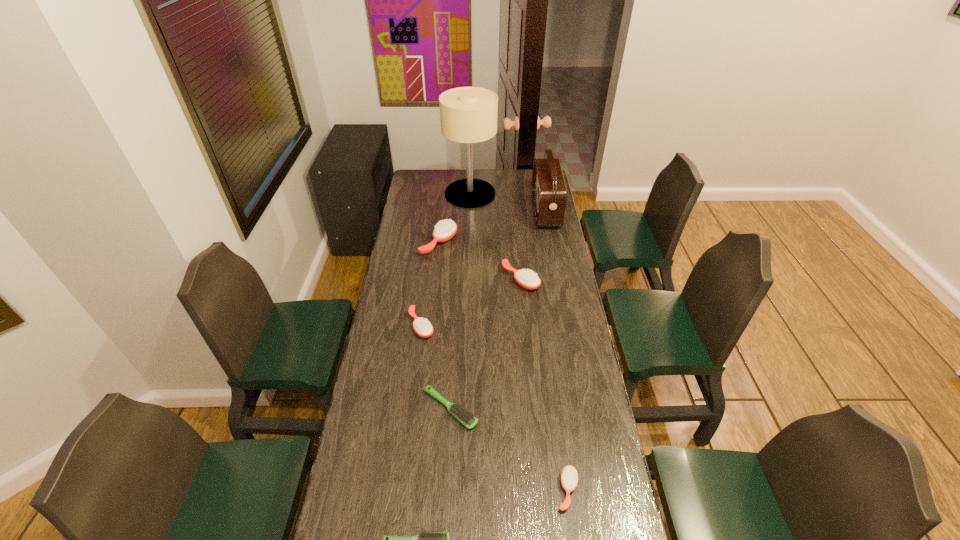
Where is `vacant space situated 0.310m on the right of the sixth farthest object`? The height and width of the screenshot is (540, 960). vacant space situated 0.310m on the right of the sixth farthest object is located at coordinates (568, 409).

Identify the location of free space located on the back of the smallest orange hairbrush. The height and width of the screenshot is (540, 960). (561, 444).

Locate an element on the screen. The image size is (960, 540). object located in the far edge section of the desktop is located at coordinates (468, 115).

I want to click on radio receiver positioned at the right edge, so click(549, 193).

Locate an element on the screen. vacant space at the far edge is located at coordinates (464, 170).

The width and height of the screenshot is (960, 540). I want to click on vacant region at the left edge of the desktop, so click(385, 303).

Identify the location of vacant space at the right edge. The height and width of the screenshot is (540, 960). (610, 495).

The width and height of the screenshot is (960, 540). In order to click on free region at the far left corner of the desktop in this screenshot , I will do `click(421, 181)`.

At what (x,y) coordinates should I click in order to perform the action: click on free space between the fourth farthest object and the tallest hairbrush. Please return your answer as a coordinate pair (x, y). Image resolution: width=960 pixels, height=540 pixels. Looking at the image, I should click on (480, 261).

What are the coordinates of `empty space that is in between the seventh shortest object and the tallest hairbrush` in the screenshot? It's located at (492, 227).